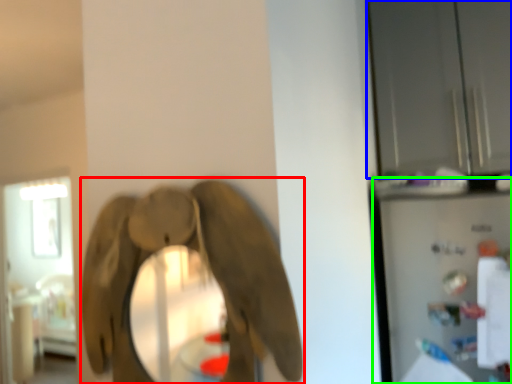
Question: Which is nearer to the elephant (highlighted by a red box)? glass door (highlighted by a blue box) or appliance (highlighted by a green box).

Choices:
 (A) glass door
 (B) appliance

Answer: (B)